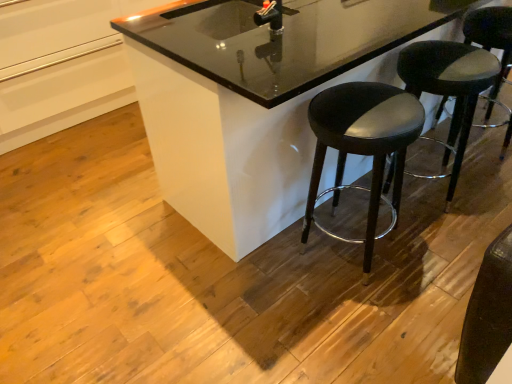
Question: Is the position of black glossy counter at center less distant than that of black leather stool at lower right, which is the 2th stool in left-to-right order?

Choices:
 (A) yes
 (B) no

Answer: (A)

Question: Could you tell me if black glossy counter at center is turned towards black leather stool at lower right, which is the 2th stool in left-to-right order?

Choices:
 (A) yes
 (B) no

Answer: (A)

Question: From a real-world perspective, does black glossy counter at center sit lower than black leather stool at lower right, which is the second stool from right to left?

Choices:
 (A) yes
 (B) no

Answer: (B)

Question: Considering the relative sizes of black glossy counter at center and black leather stool at lower right, which is the second stool from right to left, in the image provided, is black glossy counter at center wider than black leather stool at lower right, which is the second stool from right to left,?

Choices:
 (A) no
 (B) yes

Answer: (B)

Question: Is black glossy counter at center at the left side of black leather stool at lower right, which is the second stool from right to left?

Choices:
 (A) yes
 (B) no

Answer: (A)

Question: Considering the relative sizes of black glossy counter at center and black leather stool at lower right, which is the 2th stool in left-to-right order, in the image provided, is black glossy counter at center bigger than black leather stool at lower right, which is the 2th stool in left-to-right order,?

Choices:
 (A) no
 (B) yes

Answer: (B)

Question: Is black leather stool at right, which is counted as the 3th stool, starting from the left, further to camera compared to black leather stool at lower right, which is the 2th stool in left-to-right order?

Choices:
 (A) yes
 (B) no

Answer: (A)

Question: Is black leather stool at right, which is counted as the 3th stool, starting from the left, bigger than black leather stool at lower right, which is the 2th stool in left-to-right order?

Choices:
 (A) no
 (B) yes

Answer: (A)

Question: Does black leather stool at right, placed as the first stool when sorted from right to left, have a lesser height compared to black leather stool at lower right, which is the second stool from right to left?

Choices:
 (A) yes
 (B) no

Answer: (B)

Question: Considering the relative positions of black leather stool at right, which is counted as the 3th stool, starting from the left, and black leather stool at lower right, which is the 2th stool in left-to-right order, in the image provided, is black leather stool at right, which is counted as the 3th stool, starting from the left, to the right of black leather stool at lower right, which is the 2th stool in left-to-right order, from the viewer's perspective?

Choices:
 (A) no
 (B) yes

Answer: (B)

Question: Would you say black leather stool at right, placed as the first stool when sorted from right to left, is outside black leather stool at lower right, which is the second stool from right to left?

Choices:
 (A) yes
 (B) no

Answer: (A)

Question: Does black leather stool at right, placed as the first stool when sorted from right to left, have a greater width compared to black leather stool at lower right, which is the 2th stool in left-to-right order?

Choices:
 (A) no
 (B) yes

Answer: (A)

Question: From a real-world perspective, does black leather stool at center, the first stool in the left-to-right sequence, sit lower than black glossy counter at center?

Choices:
 (A) no
 (B) yes

Answer: (B)